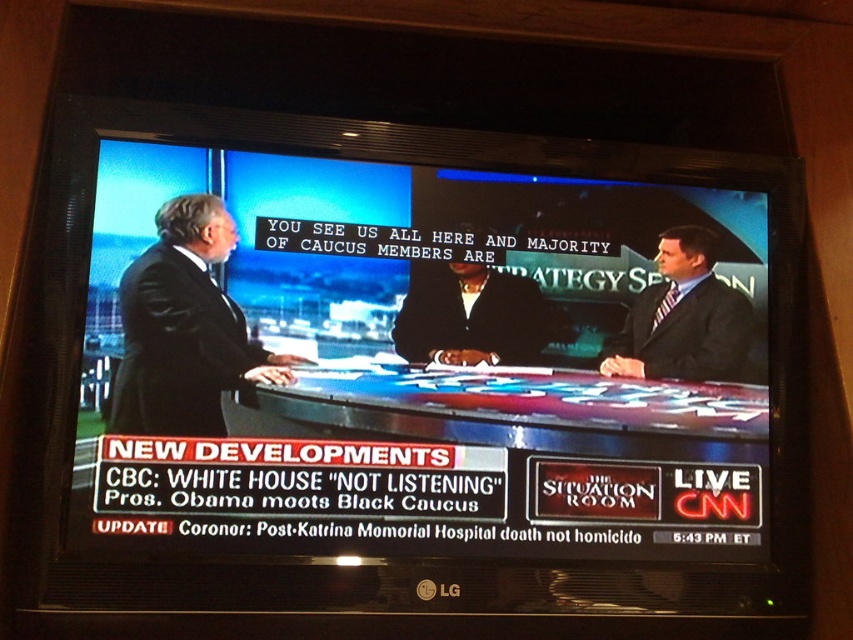
Between point (656, 264) and point (399, 326), which one is positioned behind?

Point (656, 264)

Is matte black suit at right below dark suit at center?

Correct, matte black suit at right is located below dark suit at center.

Which is in front, point (602, 358) or point (399, 337)?

Point (399, 337) is more forward.

The height and width of the screenshot is (640, 853). Find the location of `matte black suit at right`. matte black suit at right is located at coordinates (683, 317).

Is point (212, 214) behind point (720, 300)?

No, (212, 214) is closer to viewer.

Which of these two, black suit at left or matte black suit at right, stands shorter?

With less height is matte black suit at right.

Is point (201, 336) closer to viewer compared to point (674, 237)?

Yes, it is.

Where is `black suit at left`? Image resolution: width=853 pixels, height=640 pixels. black suit at left is located at coordinates (184, 330).

Between point (270, 433) and point (178, 381), which one is positioned behind?

The point (270, 433) is behind.

How much distance is there between matte black table at center and black suit at left?

A distance of 15.09 centimeters exists between matte black table at center and black suit at left.

Is point (590, 294) behind point (216, 360)?

Yes, point (590, 294) is behind point (216, 360).

You are a GUI agent. You are given a task and a screenshot of the screen. Output one action in this format:
    pyautogui.click(x=<x>, y=<y>)
    Task: Click on the matte black table at center
    The image size is (853, 640).
    Given the screenshot: What is the action you would take?
    pyautogui.click(x=432, y=362)